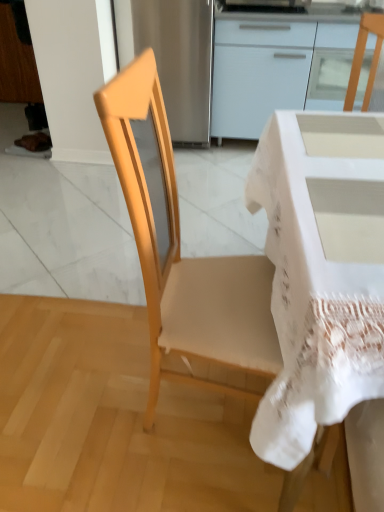
This screenshot has height=512, width=384. I want to click on vacant space in light wood chair at center (from a real-world perspective), so click(x=200, y=403).